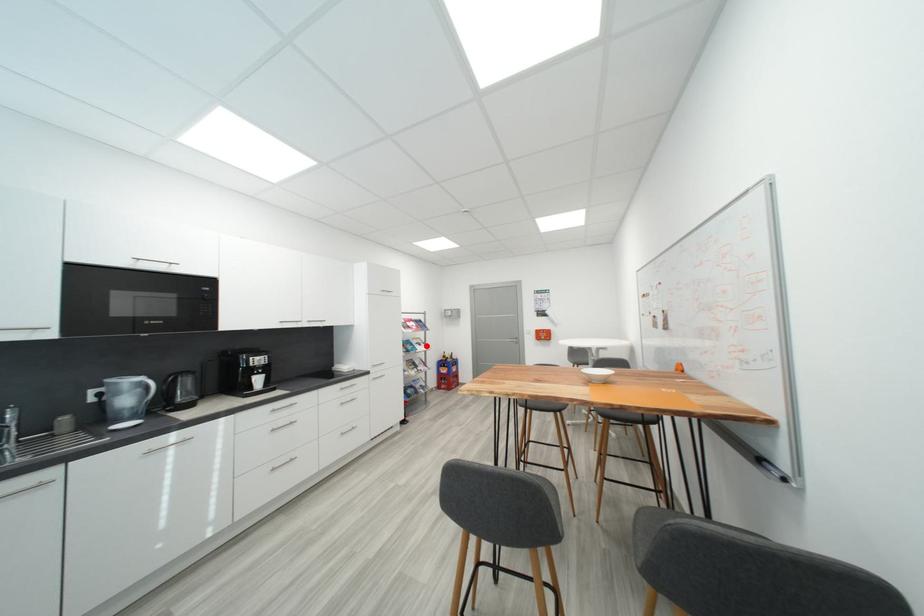
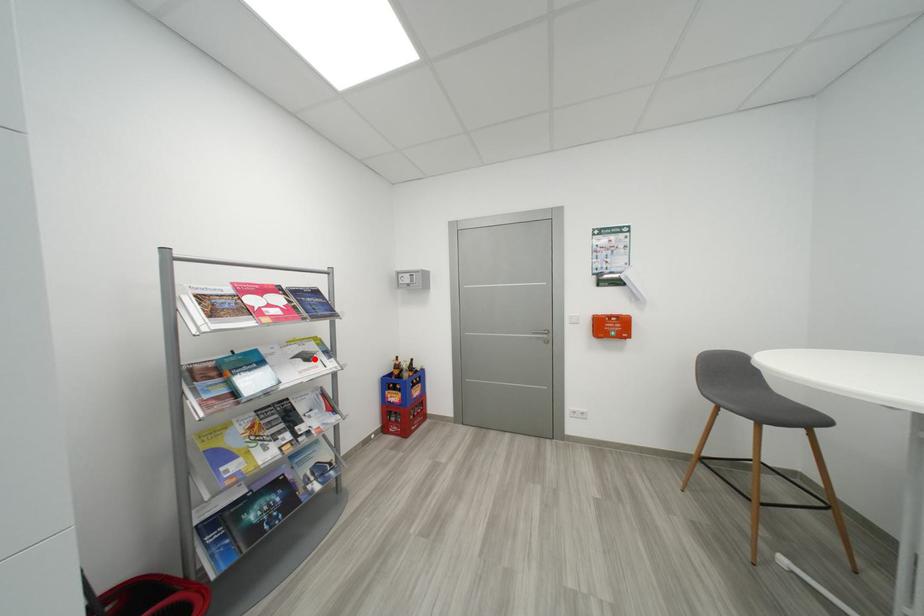
Looking at this image, I am providing you with two images of the same scene from different viewpoints. A red point is marked on the first image and another point is marked on the second image. Is the red point in image1 aligned with the point shown in image2?

Yes